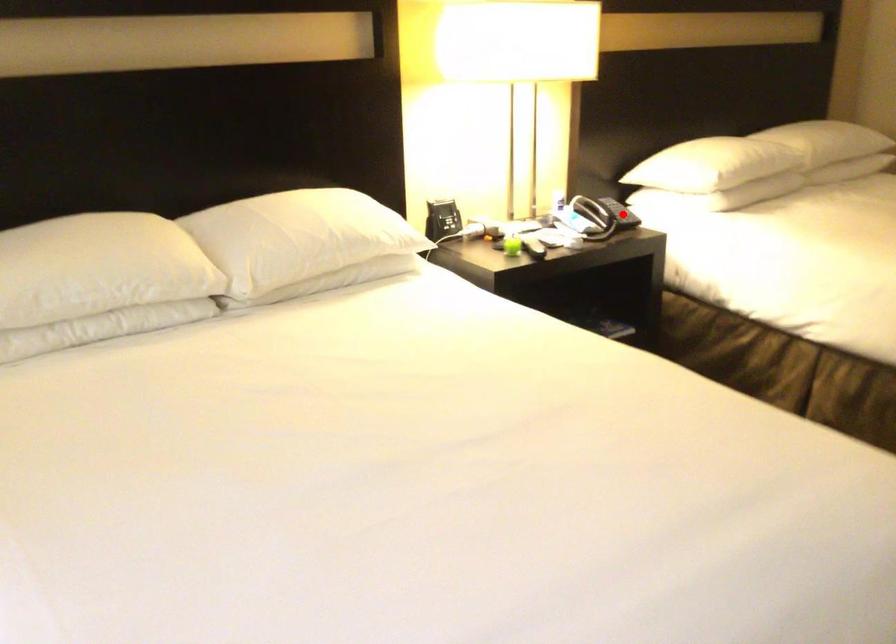
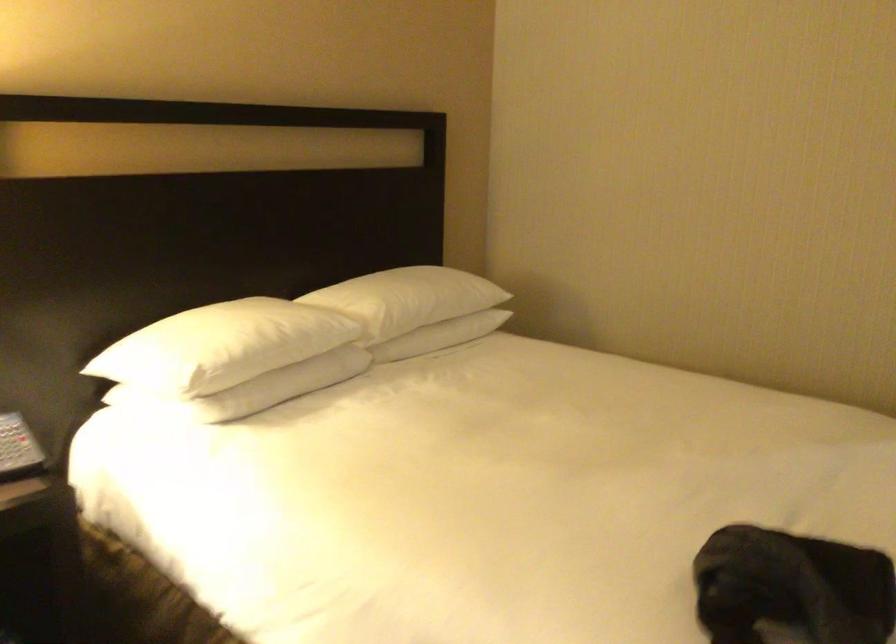
Question: I am providing you with two images of the same scene from different viewpoints. Given a red point in image1, look at the same physical point in image2. Is it:

Choices:
 (A) Closer to the viewpoint
 (B) Farther from the viewpoint

Answer: (A)